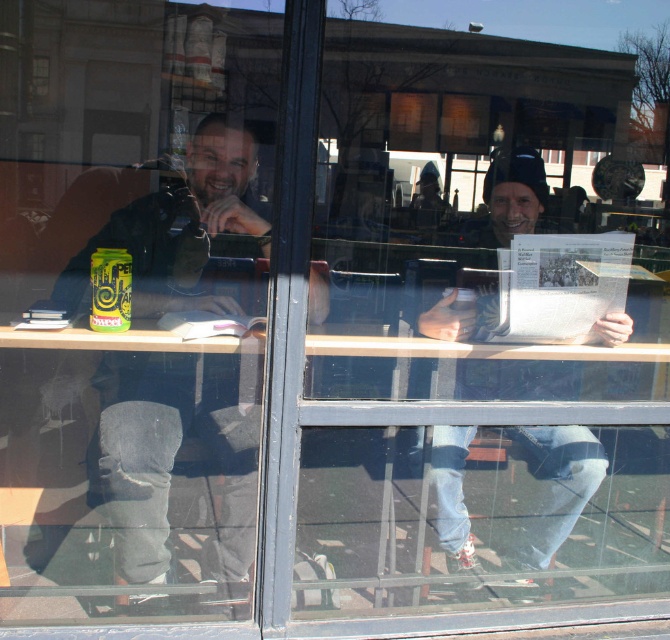
You are standing outside the window and want to toss a small paper airplane to the person wearing the dark gray jeans at left. The plane can travel 5 feet. Will it reach them?

The dark gray jeans at left is 6.24 feet away from the viewer, so the paper airplane cannot reach them as it can only travel 5 feet.

You are a delivery person standing outside the window. You need to place a small package between the dark gray jeans at left and the white paper newspaper at center. The package is 12 inches long. Can you fit it between them without moving either object?

The distance between the dark gray jeans at left and the white paper newspaper at center is 30.53 inches. Since the package is only 12 inches long, it can easily fit in the space between them without needing to move either object.

You are standing outside the cafe and want to take a photo of the point marked at coordinates point [134,570]. The camera you are using has a minimum focus distance of 8 feet. Will the camera be able to focus on the point?

The point [134,570] is 7.92 feet away from the camera, which is within the minimum focus distance of 8 feet. Therefore, the camera should be able to focus on the point.